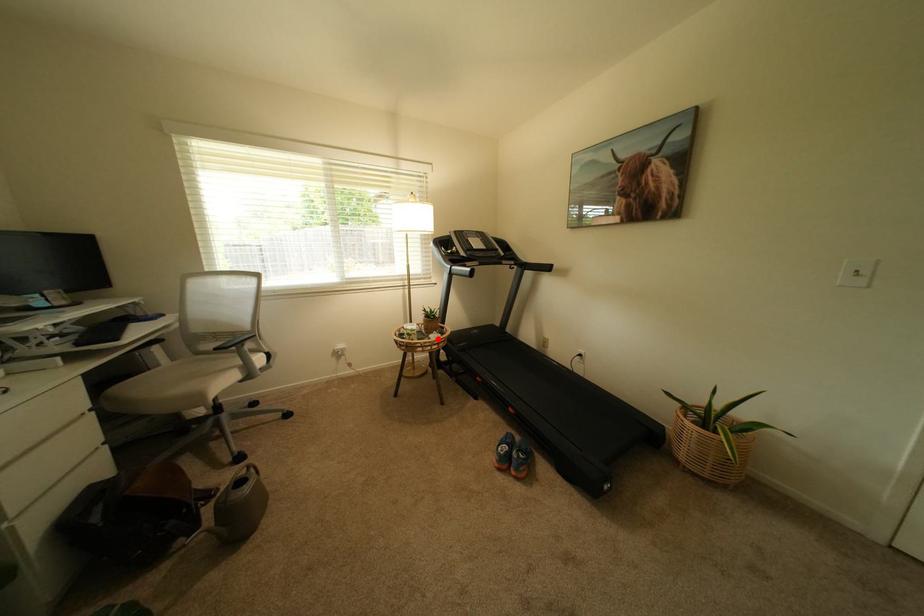
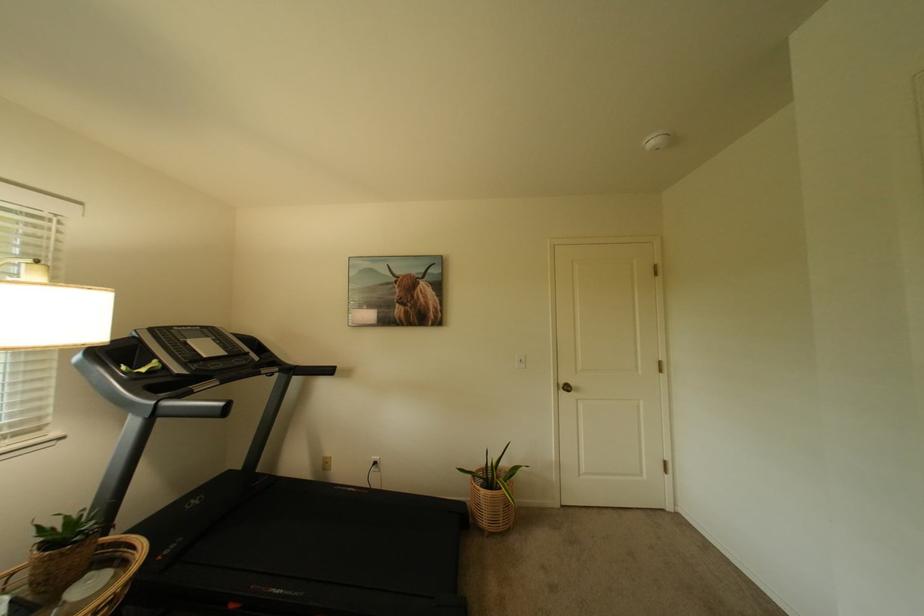
Question: I am providing you with two images of the same scene from different viewpoints. In image1, a red point is highlighted. Considering the same 3D point in image2, which of the following is correct?

Choices:
 (A) It is closer
 (B) It is farther

Answer: (A)